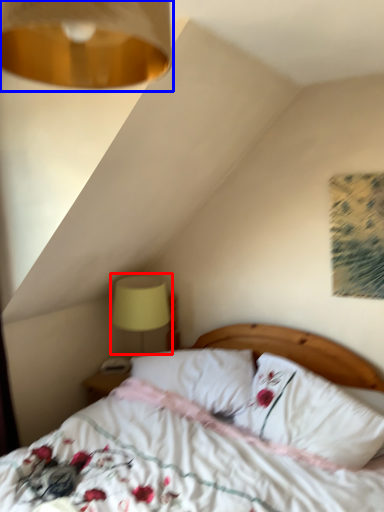
Question: Which of the following is the closest to the observer, table lamp (highlighted by a red box) or lamp (highlighted by a blue box)?

Choices:
 (A) table lamp
 (B) lamp

Answer: (B)